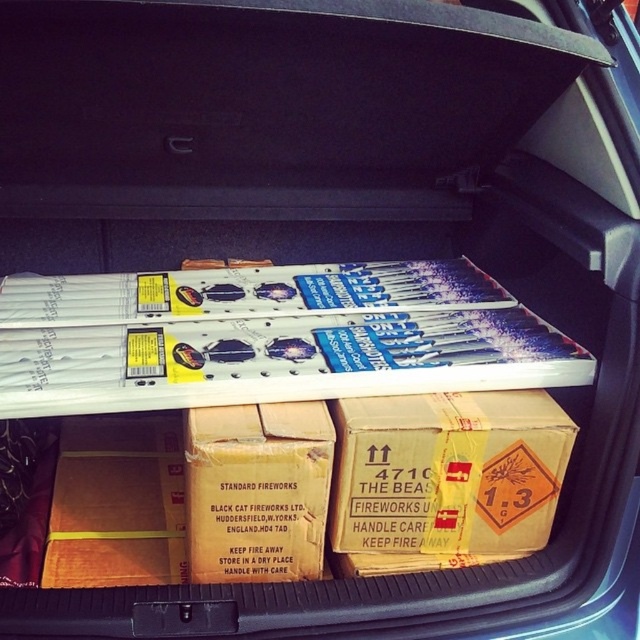
You are helping organize fireworks in a vehicle trunk. You see a black cardboard box at center and a brown cardboard box at lower center. Which box is located to the left of the other?

The black cardboard box at center is positioned on the left side of brown cardboard box at lower center.